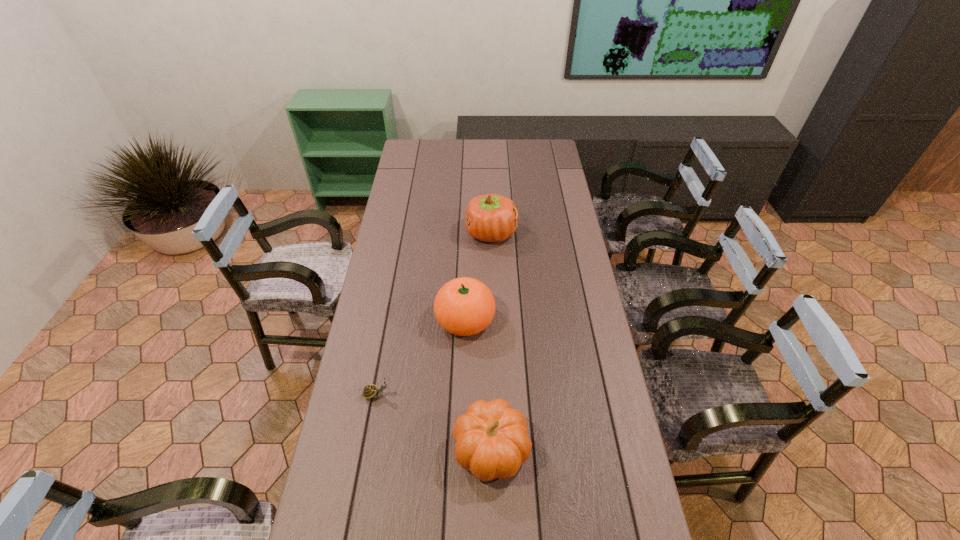
Image resolution: width=960 pixels, height=540 pixels. What are the coordinates of `free space located 0.060m on the face of the third farthest object` in the screenshot? It's located at (411, 395).

This screenshot has width=960, height=540. In order to click on object located in the left edge section of the desktop in this screenshot , I will do `click(371, 391)`.

In the image, there is a desktop. In order to click on blank space at the far edge in this screenshot , I will do `click(472, 153)`.

The image size is (960, 540). Identify the location of vacant space at the left edge. (412, 293).

Where is `vacant area at the right edge`? This screenshot has width=960, height=540. vacant area at the right edge is located at coordinates [577, 282].

Locate an element on the screen. free space at the far left corner of the desktop is located at coordinates (419, 164).

I want to click on vacant space at the far right corner of the desktop, so click(539, 144).

Identify the location of vacant region between the leftmost object and the nearest object. The height and width of the screenshot is (540, 960). click(x=434, y=422).

Locate an element on the screen. vacant space that's between the farthest object and the nearest object is located at coordinates (492, 341).

The width and height of the screenshot is (960, 540). I want to click on unoccupied position between the second nearest pumpkin and the leftmost object, so click(420, 357).